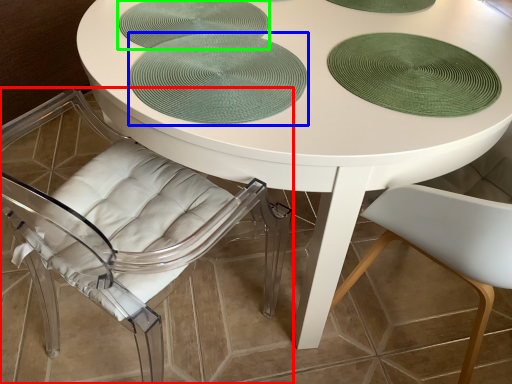
Question: Based on their relative distances, which object is nearer to chair (highlighted by a red box)? Choose from poker table (highlighted by a blue box) and glass plate (highlighted by a green box).

Choices:
 (A) poker table
 (B) glass plate

Answer: (B)